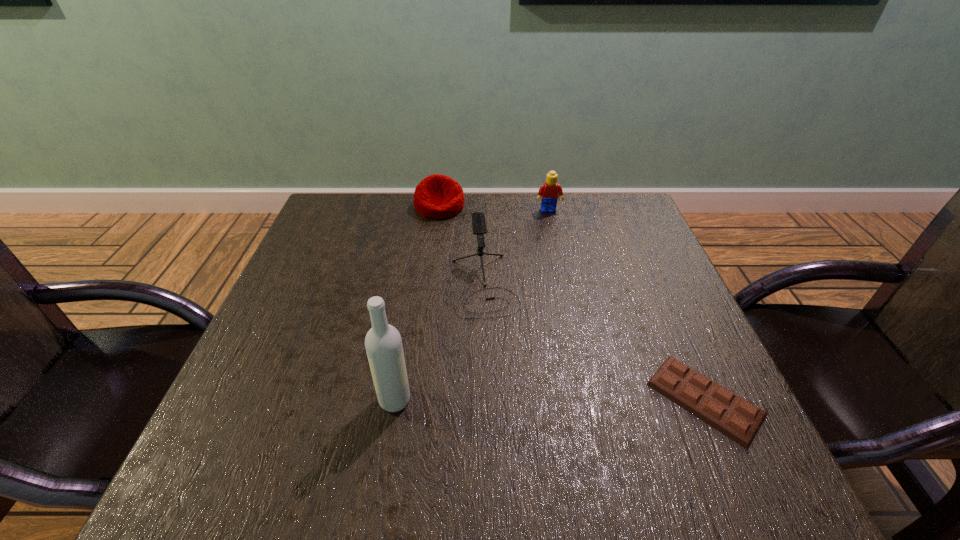
The width and height of the screenshot is (960, 540). I want to click on free space located 0.100m on the stand of the microphone, so click(500, 356).

The height and width of the screenshot is (540, 960). I want to click on vacant space located 0.120m on the seat area of the second shortest object, so click(458, 245).

Where is `vacant space situated on the seat area of the second shortest object`? Image resolution: width=960 pixels, height=540 pixels. vacant space situated on the seat area of the second shortest object is located at coordinates (482, 296).

The width and height of the screenshot is (960, 540). What are the coordinates of `blank area located on the seat area of the second shortest object` in the screenshot? It's located at (474, 279).

Where is `vacant position located 0.140m on the front-facing side of the second object from right to left`? This screenshot has width=960, height=540. vacant position located 0.140m on the front-facing side of the second object from right to left is located at coordinates (556, 244).

Where is `vacant region located on the front-facing side of the second object from right to left`? vacant region located on the front-facing side of the second object from right to left is located at coordinates (553, 230).

You are a GUI agent. You are given a task and a screenshot of the screen. Output one action in this format:
    pyautogui.click(x=<x>, y=<y>)
    Task: Click on the free space located on the front-facing side of the second object from right to left
    
    Given the screenshot: What is the action you would take?
    pyautogui.click(x=567, y=297)

Where is `beanbag that is at the far edge`? beanbag that is at the far edge is located at coordinates (437, 196).

At what (x,y) coordinates should I click in order to perform the action: click on Lego located at the far edge. Please return your answer as a coordinate pair (x, y). The image size is (960, 540). Looking at the image, I should click on (549, 191).

At what (x,y) coordinates should I click in order to perform the action: click on vodka that is at the near edge. Please return your answer as a coordinate pair (x, y). This screenshot has height=540, width=960. Looking at the image, I should click on (383, 343).